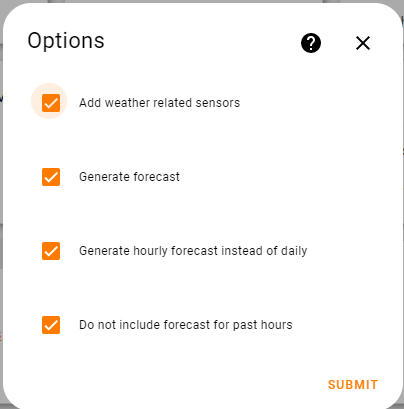
This screenshot has width=404, height=409. Find the location of `exit button`. exit button is located at coordinates (363, 44).